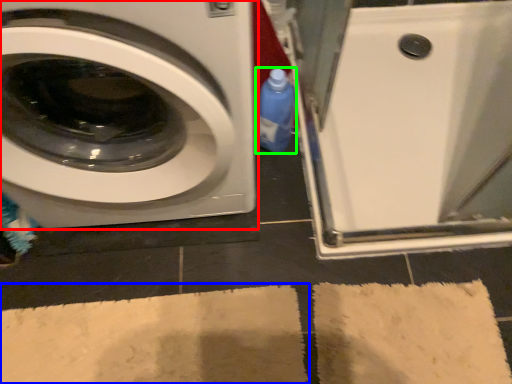
Question: Which is farther away from washing machine (highlighted by a red box)? bath mat (highlighted by a blue box) or cleaning product (highlighted by a green box)?

Choices:
 (A) bath mat
 (B) cleaning product

Answer: (A)